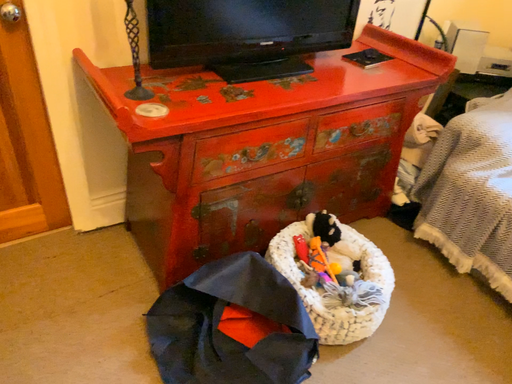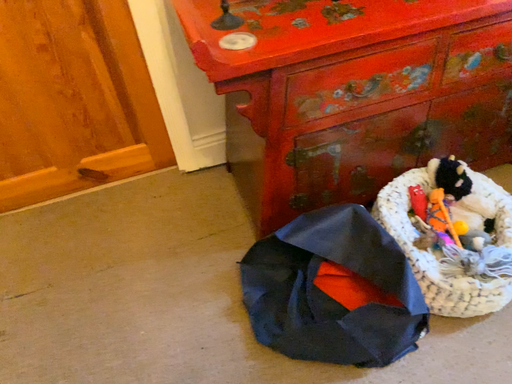
Question: How did the camera likely rotate when shooting the video?

Choices:
 (A) rotated upward
 (B) rotated downward

Answer: (B)